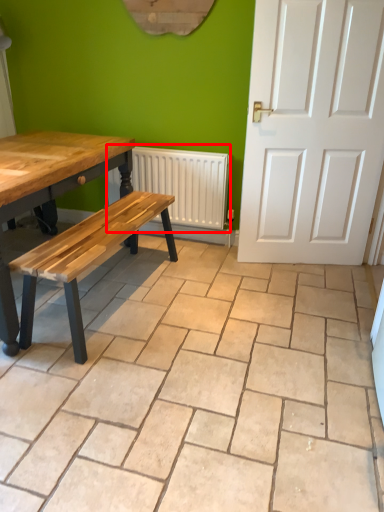
Question: From the image's perspective, considering the relative positions of radiator (annotated by the red box) and ceramic tile in the image provided, where is radiator (annotated by the red box) located with respect to the staircase?

Choices:
 (A) below
 (B) above

Answer: (B)